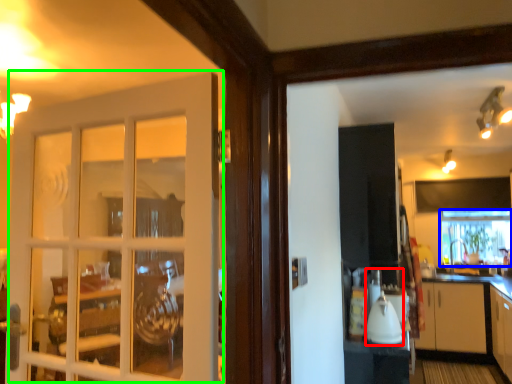
Question: Based on their relative distances, which object is nearer to appliance (highlighted by a red box)? Choose from window frame (highlighted by a blue box) and door (highlighted by a green box).

Choices:
 (A) window frame
 (B) door

Answer: (B)